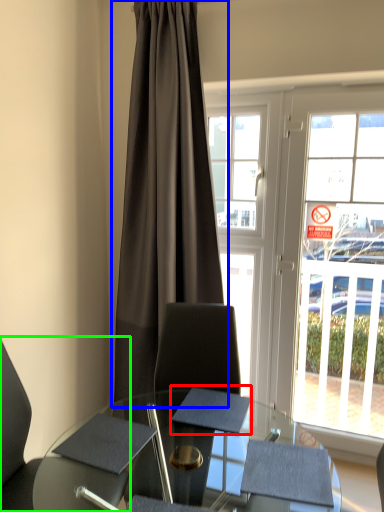
Question: Which object is positioned farthest from notepad (highlighted by a red box)? Select from curtain (highlighted by a blue box) and chair (highlighted by a green box).

Choices:
 (A) curtain
 (B) chair

Answer: (A)